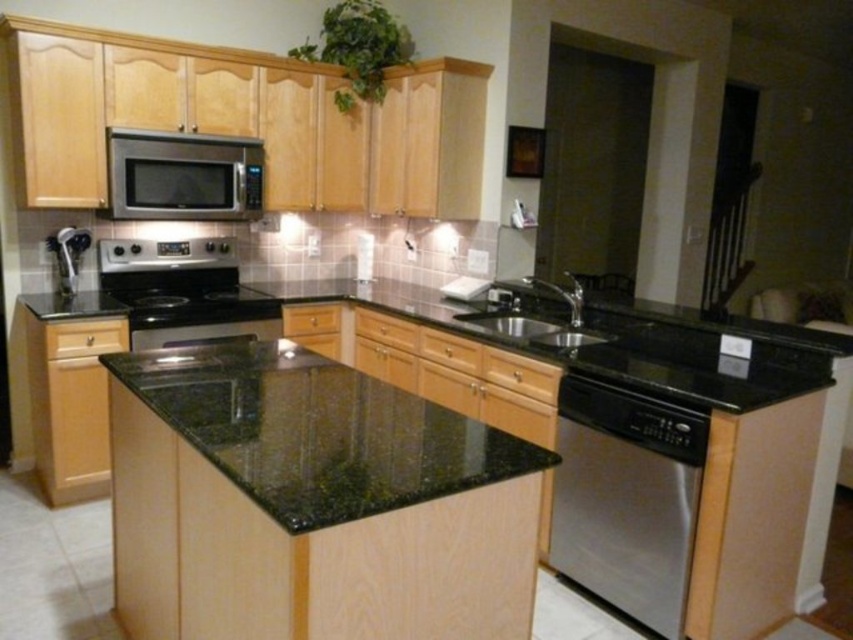
You are a chef preparing to wash dishes. You see the satin black stove at center and the black granite sink at center. Which one should you walk towards to reach the sink first?

The black granite sink at center is behind the satin black stove at center, so you should walk towards the black granite sink at center first to reach it since it is positioned behind the stove.

You are standing in the kitchen and want to locate the satin stainless steel dishwasher at lower right. According to the 2D coordinates provided, where should you look relative to the center of the image?

The satin stainless steel dishwasher at lower right is located at coordinates 0.781 on the x axis and 0.735 on the y axis, which places it to the right and slightly below the center of the image.